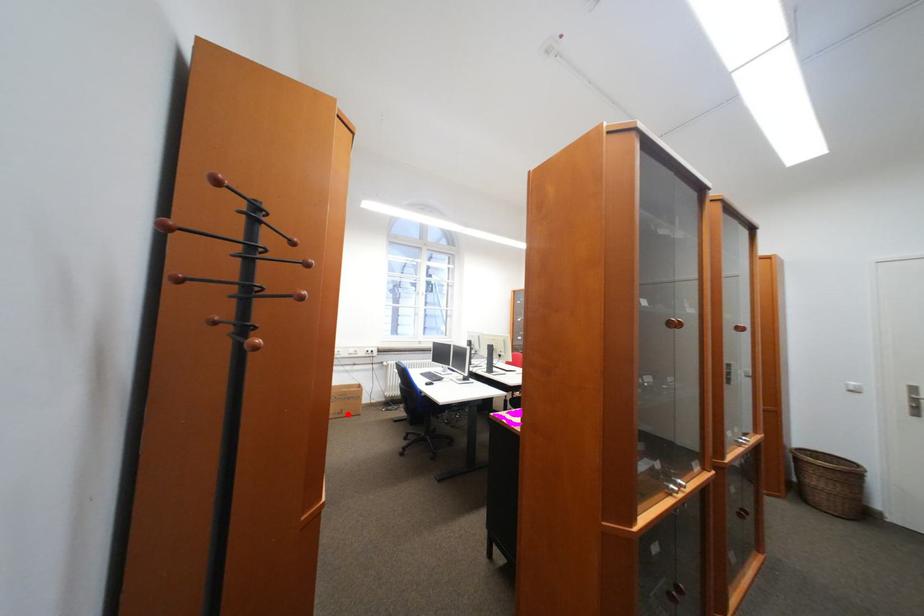
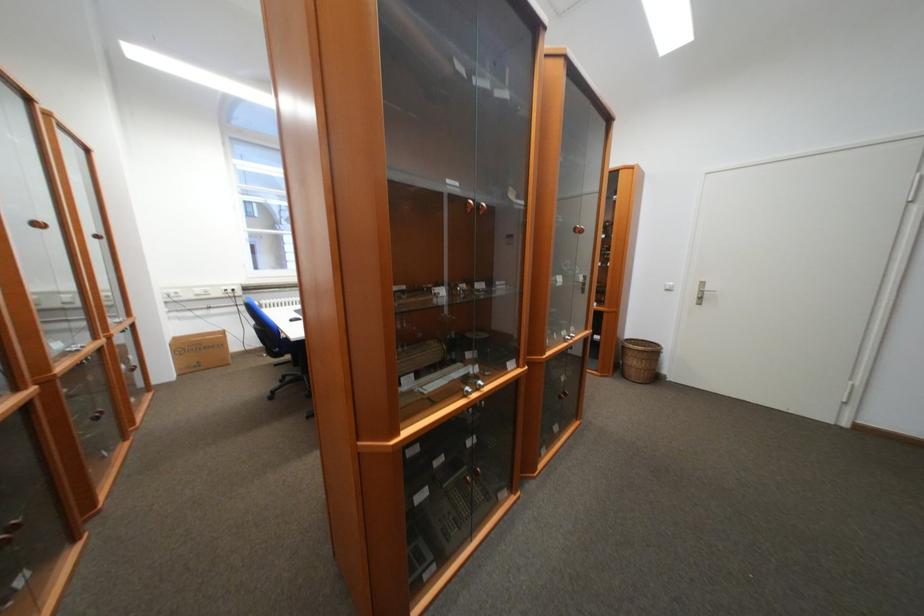
Question: I am providing you with two images of the same scene from different viewpoints. Given a red point in image1, look at the same physical point in image2. Is it:

Choices:
 (A) Closer to the viewpoint
 (B) Farther from the viewpoint

Answer: (A)